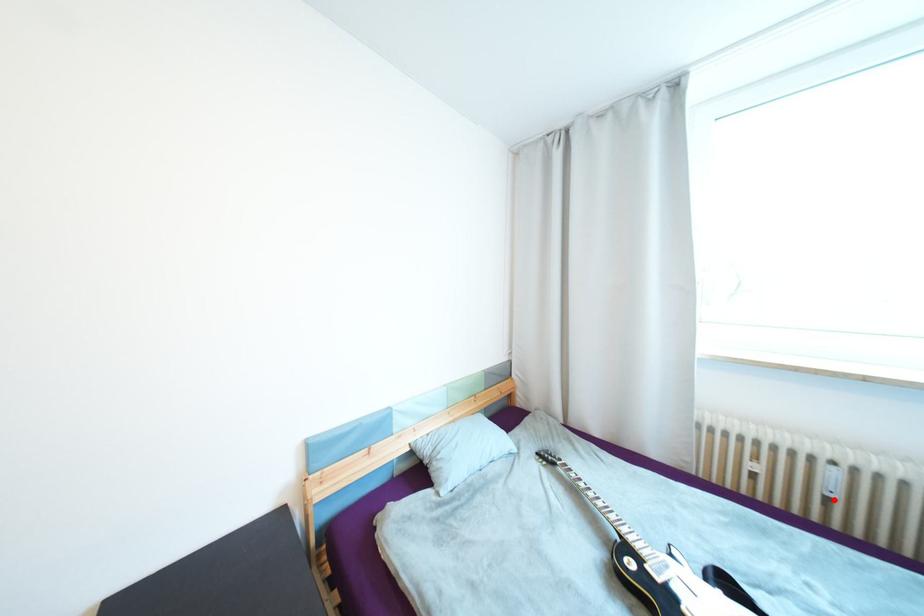
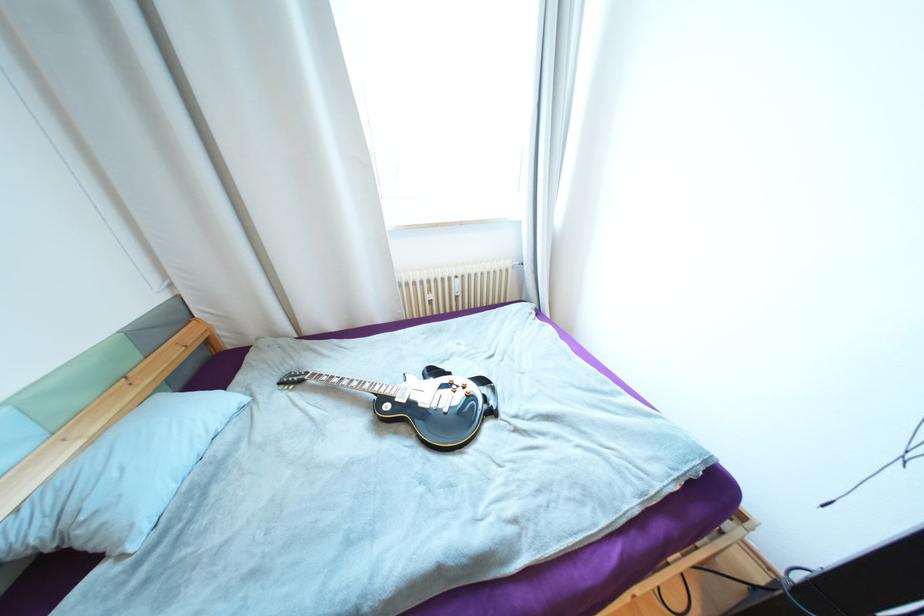
Question: I am providing you with two images of the same scene from different viewpoints. A red point is shown in image1. For the corresponding object point in image2, is it positioned nearer or farther from the camera?

Choices:
 (A) Nearer
 (B) Farther

Answer: (B)